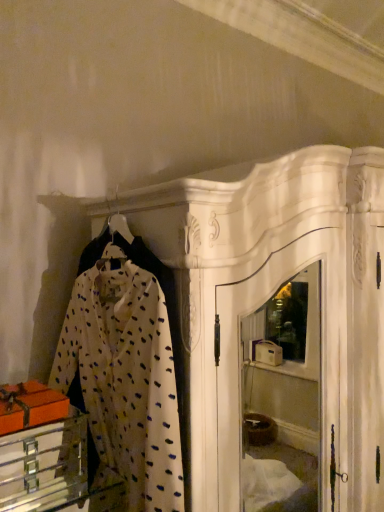
Locate an element on the screen. Image resolution: width=384 pixels, height=512 pixels. metallic silver drawer at lower left is located at coordinates (45, 467).

The width and height of the screenshot is (384, 512). What do you see at coordinates (45, 467) in the screenshot? I see `metallic silver drawer at lower left` at bounding box center [45, 467].

I want to click on white dotted fabric at center, so click(x=124, y=383).

Measure the distance between white dotted fabric at center and camera.

white dotted fabric at center is 89.02 centimeters away from camera.

This screenshot has height=512, width=384. What do you see at coordinates (124, 383) in the screenshot? I see `white dotted fabric at center` at bounding box center [124, 383].

Locate an element on the screen. This screenshot has width=384, height=512. metallic silver drawer at lower left is located at coordinates (45, 467).

Does metallic silver drawer at lower left appear on the right side of white dotted fabric at center?

In fact, metallic silver drawer at lower left is to the left of white dotted fabric at center.

In the image, is metallic silver drawer at lower left positioned in front of or behind white dotted fabric at center?

Visually, metallic silver drawer at lower left is located behind white dotted fabric at center.

Is point (71, 462) farther from viewer compared to point (114, 424)?

Yes, point (71, 462) is farther from viewer.

From the image's perspective, is metallic silver drawer at lower left above or below white dotted fabric at center?

Clearly, from the image's perspective, metallic silver drawer at lower left is below white dotted fabric at center.

From a real-world perspective, does metallic silver drawer at lower left stand above white dotted fabric at center?

No, from a real-world perspective, metallic silver drawer at lower left is not on top of white dotted fabric at center.

In the scene shown: Considering the sizes of objects metallic silver drawer at lower left and white dotted fabric at center in the image provided, who is thinner, metallic silver drawer at lower left or white dotted fabric at center?

white dotted fabric at center.

Considering the sizes of objects metallic silver drawer at lower left and white dotted fabric at center in the image provided, who is shorter, metallic silver drawer at lower left or white dotted fabric at center?

With less height is metallic silver drawer at lower left.

Is metallic silver drawer at lower left bigger or smaller than white dotted fabric at center?

Considering their sizes, metallic silver drawer at lower left takes up less space than white dotted fabric at center.

Is metallic silver drawer at lower left situated inside white dotted fabric at center or outside?

The correct answer is: outside.

Is metallic silver drawer at lower left beside white dotted fabric at center?

No, metallic silver drawer at lower left is not next to white dotted fabric at center.

Is metallic silver drawer at lower left facing away from white dotted fabric at center?

metallic silver drawer at lower left does not have its back to white dotted fabric at center.

How different are the orientations of metallic silver drawer at lower left and white dotted fabric at center in degrees?

They differ by 94.2 degrees in their facing directions.

You are a GUI agent. You are given a task and a screenshot of the screen. Output one action in this format:
    pyautogui.click(x=<x>, y=<y>)
    Task: Click on the furniture behind the white dotted fabric at center
    The width and height of the screenshot is (384, 512).
    Given the screenshot: What is the action you would take?
    pyautogui.click(x=45, y=467)

Is white dotted fabric at center to the left of metallic silver drawer at lower left from the viewer's perspective?

Incorrect, white dotted fabric at center is not on the left side of metallic silver drawer at lower left.

Is white dotted fabric at center in front of or behind metallic silver drawer at lower left in the image?

Clearly, white dotted fabric at center is in front of metallic silver drawer at lower left.

Is point (151, 458) behind point (29, 452)?

No, (151, 458) is in front of (29, 452).

From the image's perspective, which is below, white dotted fabric at center or metallic silver drawer at lower left?

metallic silver drawer at lower left is shown below in the image.

From a real-world perspective, is white dotted fabric at center located beneath metallic silver drawer at lower left?

No.

Which of these two, white dotted fabric at center or metallic silver drawer at lower left, is thinner?

Thinner between the two is white dotted fabric at center.

Considering the relative sizes of white dotted fabric at center and metallic silver drawer at lower left in the image provided, is white dotted fabric at center shorter than metallic silver drawer at lower left?

No.

Is white dotted fabric at center bigger than metallic silver drawer at lower left?

Yes.

Is metallic silver drawer at lower left a part of white dotted fabric at center?

Yes, metallic silver drawer at lower left is inside white dotted fabric at center.

Is white dotted fabric at center directly adjacent to metallic silver drawer at lower left?

No.

Is white dotted fabric at center facing towards metallic silver drawer at lower left?

Yes, white dotted fabric at center is oriented towards metallic silver drawer at lower left.

At what (x,y) coordinates should I click in order to perform the action: click on clothing above the metallic silver drawer at lower left (from a real-world perspective). Please return your answer as a coordinate pair (x, y). The image size is (384, 512). Looking at the image, I should click on (124, 383).

I want to click on clothing on the right of metallic silver drawer at lower left, so click(x=124, y=383).

Find the location of a particular element. The width and height of the screenshot is (384, 512). clothing that appears above the metallic silver drawer at lower left (from the image's perspective) is located at coordinates (124, 383).